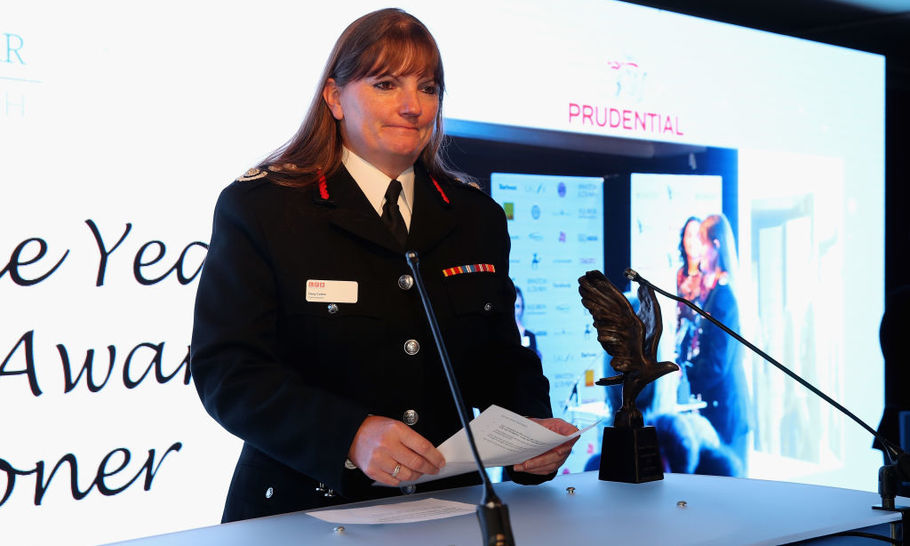
At what (x,y) coordinates should I click in order to perform the action: click on black text cursive writing on the wall behind the speaker. Please return your answer as a coordinate pair (x, y). Looking at the image, I should click on (86, 314).